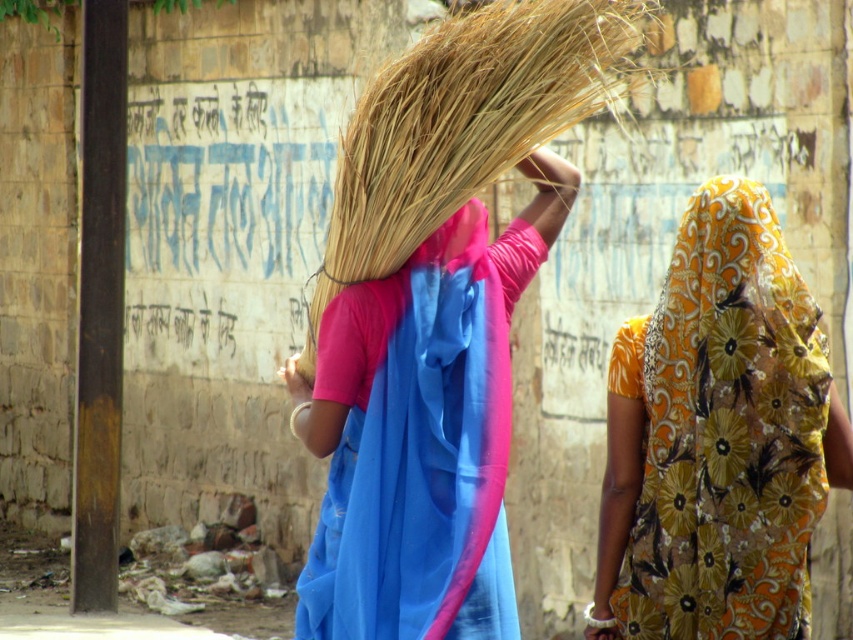
Who is lower down, blue silk sari at center or dry straw broom at center?

Positioned lower is blue silk sari at center.

Can you confirm if blue silk sari at center is positioned to the right of dry straw broom at center?

Incorrect, blue silk sari at center is not on the right side of dry straw broom at center.

Where is `blue silk sari at center`? The height and width of the screenshot is (640, 853). blue silk sari at center is located at coordinates (421, 432).

What do you see at coordinates (718, 436) in the screenshot? Image resolution: width=853 pixels, height=640 pixels. I see `floral yellow fabric at upper right` at bounding box center [718, 436].

Between point (795, 563) and point (486, 600), which one is positioned behind?

Positioned behind is point (486, 600).

The height and width of the screenshot is (640, 853). What are the coordinates of `floral yellow fabric at upper right` in the screenshot? It's located at [x=718, y=436].

Does floral yellow fabric at upper right have a lesser width compared to dry straw broom at center?

Indeed, floral yellow fabric at upper right has a lesser width compared to dry straw broom at center.

Between floral yellow fabric at upper right and dry straw broom at center, which one is positioned lower?

Positioned lower is floral yellow fabric at upper right.

Between point (672, 326) and point (416, 148), which one is positioned behind?

Point (416, 148)

The width and height of the screenshot is (853, 640). Identify the location of floral yellow fabric at upper right. (718, 436).